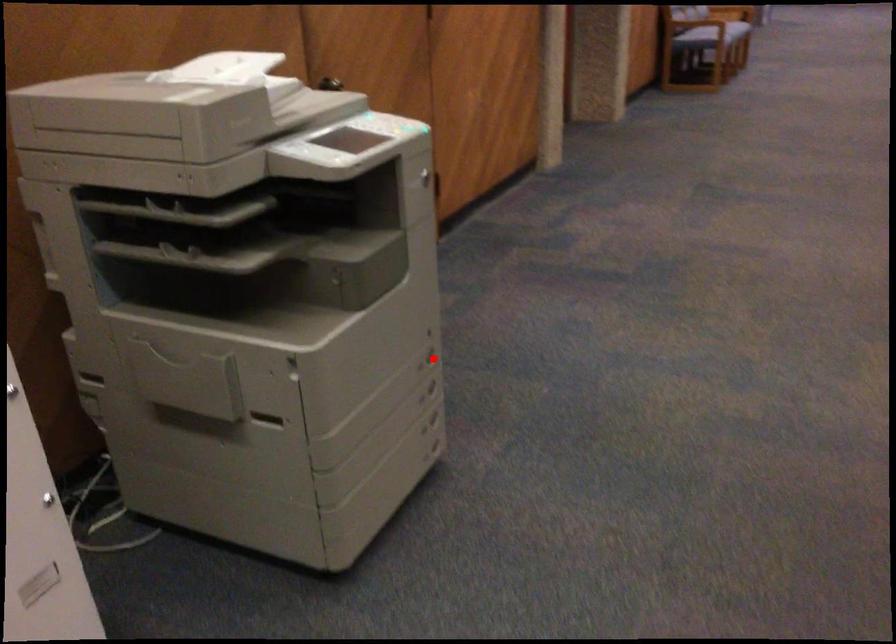
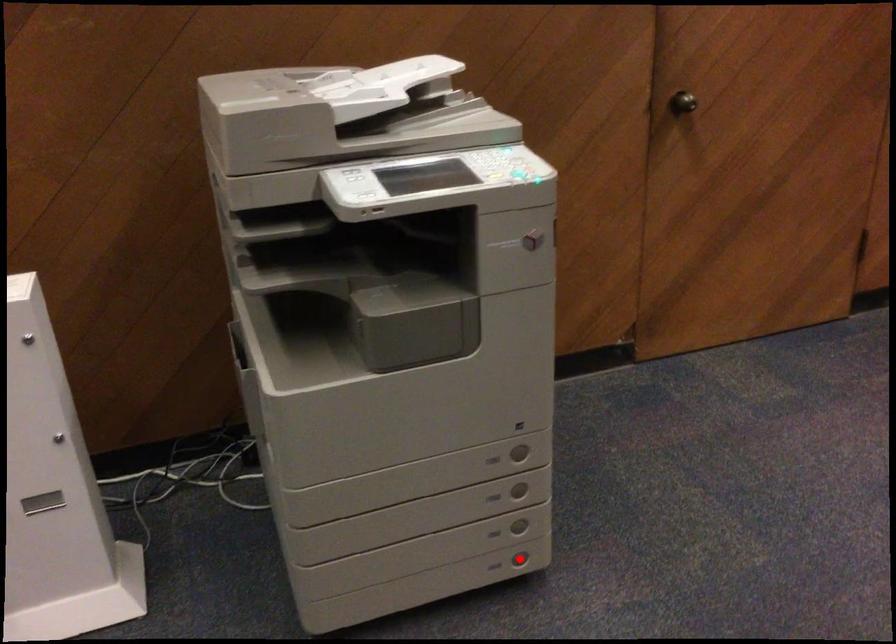
Looking at this image, I am providing you with two images of the same scene from different viewpoints. A red point is marked on the first image and another point is marked on the second image. Is the red point in image1 aligned with the point shown in image2?

No